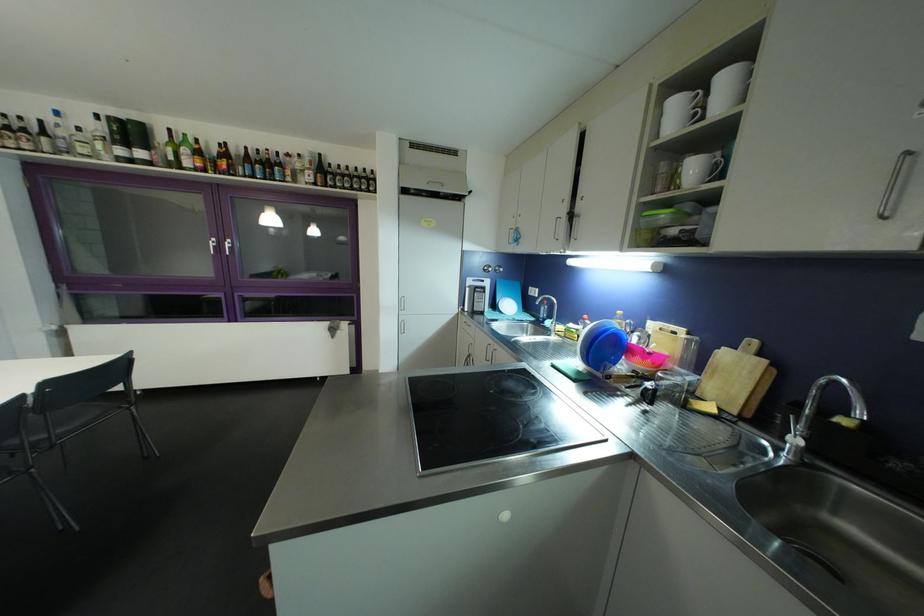
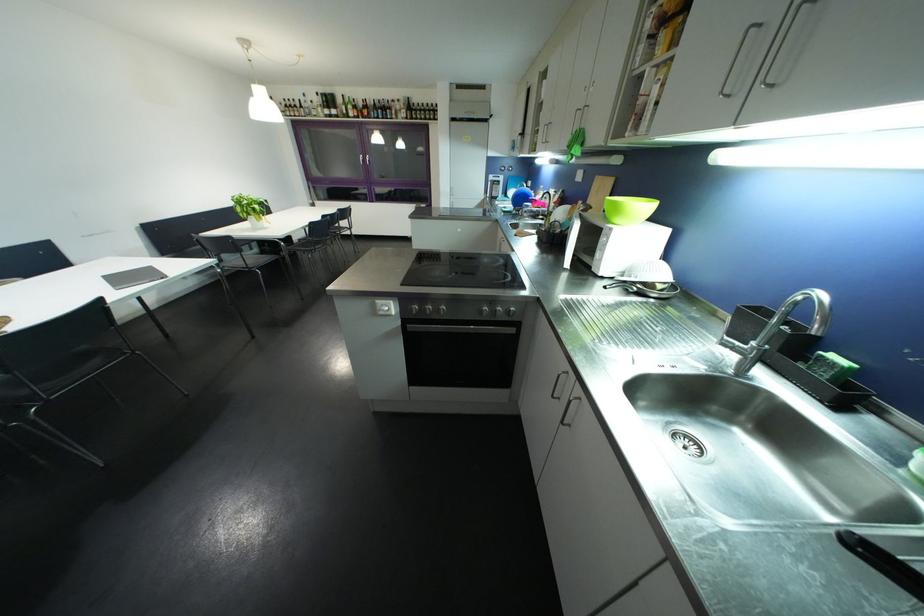
Locate, in the second image, the point that corresponds to [94,137] in the first image.

(322, 107)